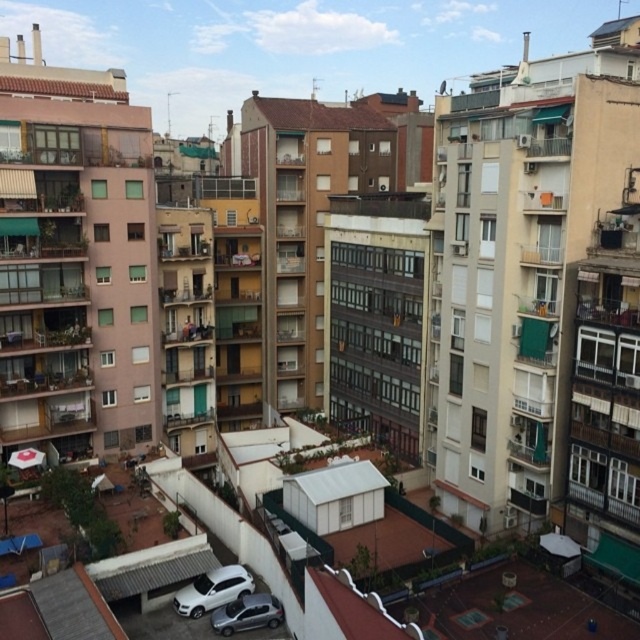
Question: Is white matte suv at center further to the viewer compared to satin silver car at lower center?

Choices:
 (A) yes
 (B) no

Answer: (A)

Question: Among these points, which one is farthest from the camera?

Choices:
 (A) (224, 611)
 (B) (232, 579)

Answer: (B)

Question: Does white matte suv at center appear on the right side of satin silver car at lower center?

Choices:
 (A) no
 (B) yes

Answer: (A)

Question: Among these objects, which one is nearest to the camera?

Choices:
 (A) satin silver car at lower center
 (B) white matte suv at center

Answer: (A)

Question: Is white matte suv at center positioned in front of satin silver car at lower center?

Choices:
 (A) yes
 (B) no

Answer: (B)

Question: Which point is closer to the camera?

Choices:
 (A) white matte suv at center
 (B) satin silver car at lower center

Answer: (B)